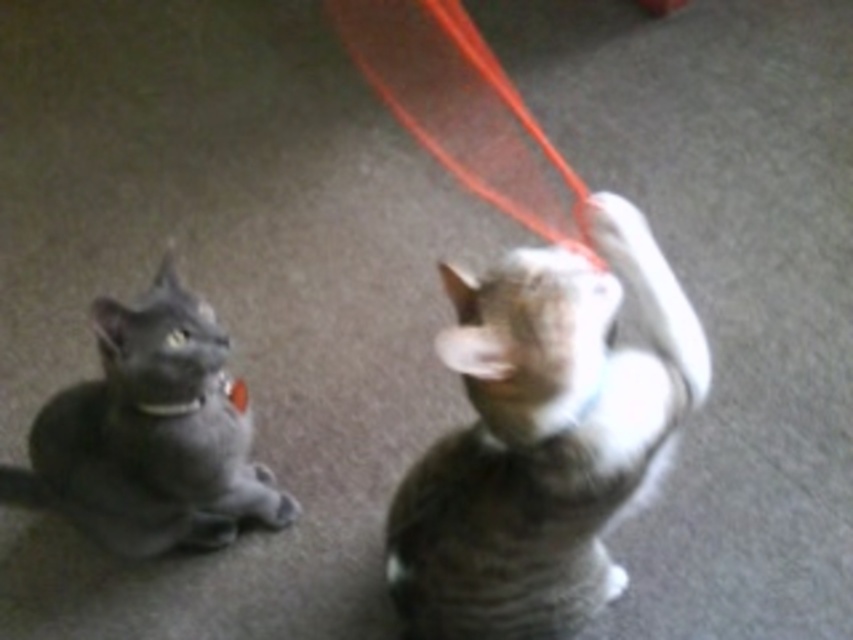
Question: Based on their relative distances, which object is nearer to the striped fur cat at center?

Choices:
 (A) matte gray cat at left
 (B) red string at upper center

Answer: (A)

Question: Which of these objects is positioned closest to the red string at upper center?

Choices:
 (A) striped fur cat at center
 (B) matte gray cat at left

Answer: (A)

Question: Which point is closer to the camera taking this photo?

Choices:
 (A) (94, 490)
 (B) (410, 10)
 (C) (490, 520)

Answer: (C)

Question: Does striped fur cat at center appear on the right side of matte gray cat at left?

Choices:
 (A) no
 (B) yes

Answer: (B)

Question: Is striped fur cat at center bigger than matte gray cat at left?

Choices:
 (A) no
 (B) yes

Answer: (B)

Question: Does matte gray cat at left have a smaller size compared to red string at upper center?

Choices:
 (A) yes
 (B) no

Answer: (A)